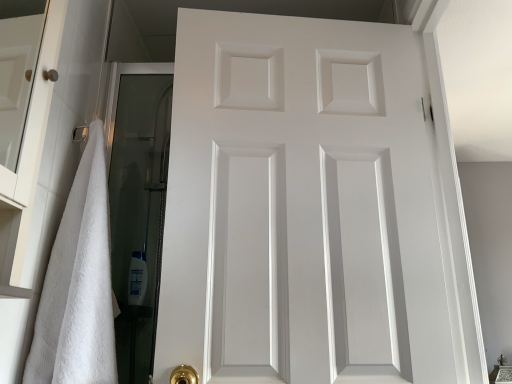
Question: Is white matte door at center inside the boundaries of white fluffy towel at left, or outside?

Choices:
 (A) inside
 (B) outside

Answer: (B)

Question: Is white matte door at center in front of or behind white fluffy towel at left in the image?

Choices:
 (A) front
 (B) behind

Answer: (B)

Question: Based on their relative distances, which object is farther from the white matte door at center?

Choices:
 (A) white glossy shampoo bottle at lower left
 (B) white fluffy towel at left

Answer: (A)

Question: Which object is the farthest from the white matte door at center?

Choices:
 (A) white glossy shampoo bottle at lower left
 (B) white fluffy towel at left

Answer: (A)